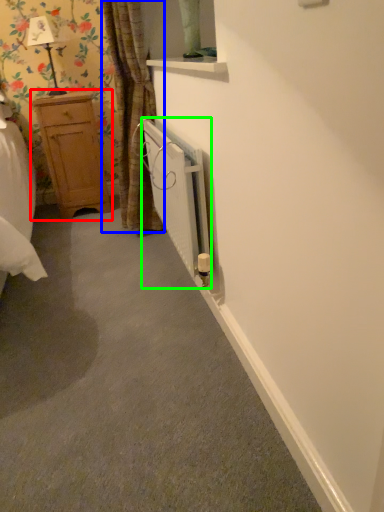
Question: Estimate the real-world distances between objects in this image. Which object is closer to dresser (highlighted by a red box), curtain (highlighted by a blue box) or radiator (highlighted by a green box)?

Choices:
 (A) curtain
 (B) radiator

Answer: (A)